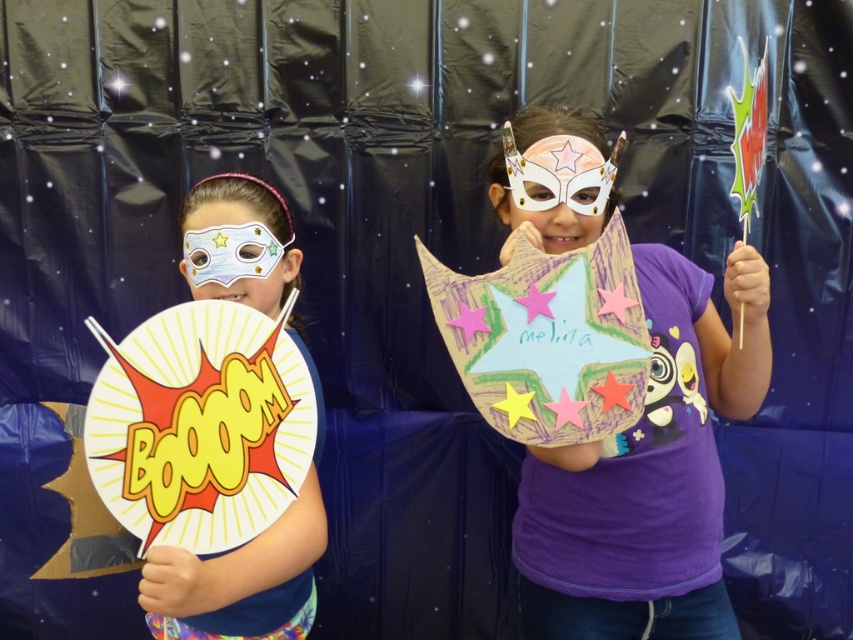
Between point (741, 388) and point (466, 314), which one is positioned in front?

Point (466, 314)

Can you confirm if purple paper star at center is bigger than pink paper star at center?

Indeed, purple paper star at center has a larger size compared to pink paper star at center.

Who is more distant from viewer, (x=686, y=369) or (x=463, y=339)?

Point (x=686, y=369)

The image size is (853, 640). Find the location of `purple paper star at center`. purple paper star at center is located at coordinates (647, 474).

Is point (277, 481) behind point (519, 397)?

No.

Who is positioned more to the right, yellow paper plate at left or yellow paper star at center?

yellow paper star at center is more to the right.

Describe the element at coordinates (199, 426) in the screenshot. This screenshot has height=640, width=853. I see `yellow paper plate at left` at that location.

Where is `yellow paper plate at left`? The height and width of the screenshot is (640, 853). yellow paper plate at left is located at coordinates (199, 426).

Is point (149, 321) farther from camera compared to point (553, 227)?

No, it is in front of (553, 227).

Does yellow paper plate at left have a smaller size compared to white paper mask at center?

Indeed, yellow paper plate at left has a smaller size compared to white paper mask at center.

At what (x,y) coordinates should I click in order to perform the action: click on yellow paper plate at left. Please return your answer as a coordinate pair (x, y). This screenshot has width=853, height=640. Looking at the image, I should click on (199, 426).

Locate an element on the screen. Image resolution: width=853 pixels, height=640 pixels. yellow paper plate at left is located at coordinates [199, 426].